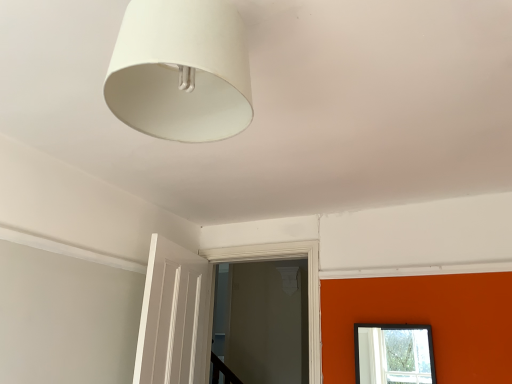
Question: Is white painted wood door frame at center facing towards white matte lampshade at upper center?

Choices:
 (A) yes
 (B) no

Answer: (A)

Question: Can you confirm if white painted wood door frame at center is taller than white matte lampshade at upper center?

Choices:
 (A) no
 (B) yes

Answer: (B)

Question: Can you confirm if white painted wood door frame at center is thinner than white matte lampshade at upper center?

Choices:
 (A) no
 (B) yes

Answer: (B)

Question: Can you confirm if white painted wood door frame at center is wider than white matte lampshade at upper center?

Choices:
 (A) no
 (B) yes

Answer: (A)

Question: Does white painted wood door frame at center lie behind white matte lampshade at upper center?

Choices:
 (A) yes
 (B) no

Answer: (A)

Question: Is white painted wood door frame at center bigger than white matte lampshade at upper center?

Choices:
 (A) yes
 (B) no

Answer: (A)

Question: From a real-world perspective, is white matte lampshade at upper center over white painted wood door frame at center?

Choices:
 (A) no
 (B) yes

Answer: (B)

Question: Is white matte lampshade at upper center far away from white painted wood door frame at center?

Choices:
 (A) no
 (B) yes

Answer: (B)

Question: Is the surface of white matte lampshade at upper center in direct contact with white painted wood door frame at center?

Choices:
 (A) yes
 (B) no

Answer: (B)

Question: Is white matte lampshade at upper center outside of white painted wood door frame at center?

Choices:
 (A) no
 (B) yes

Answer: (B)

Question: Is white matte lampshade at upper center wider than white painted wood door frame at center?

Choices:
 (A) no
 (B) yes

Answer: (B)

Question: Can you confirm if white matte lampshade at upper center is positioned to the right of white painted wood door frame at center?

Choices:
 (A) yes
 (B) no

Answer: (B)

Question: Is point (273, 258) positioned closer to the camera than point (241, 59)?

Choices:
 (A) farther
 (B) closer

Answer: (A)